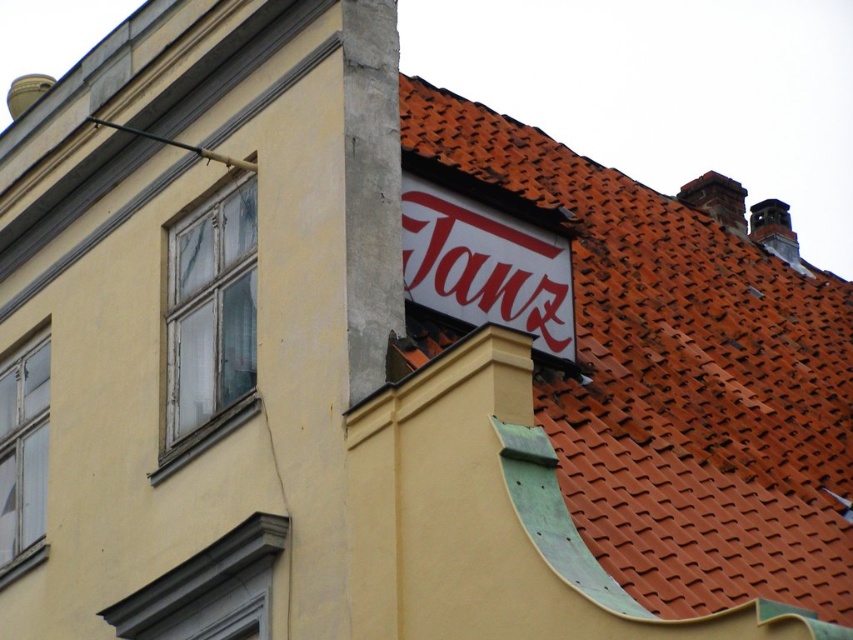
The height and width of the screenshot is (640, 853). What are the coordinates of `white wooden window at upper left` in the screenshot? It's located at (209, 320).

Is point (178, 282) closer to viewer compared to point (445, 301)?

No, it is behind (445, 301).

At what (x,y) coordinates should I click in order to perform the action: click on white wooden window at upper left. Please return your answer as a coordinate pair (x, y). Looking at the image, I should click on (209, 320).

Who is positioned more to the left, white matte sign at upper center or smooth gray window frame at lower left?

smooth gray window frame at lower left

Is white matte sign at upper center above smooth gray window frame at lower left?

Yes, white matte sign at upper center is above smooth gray window frame at lower left.

Where is `white matte sign at upper center`? The height and width of the screenshot is (640, 853). white matte sign at upper center is located at coordinates (486, 266).

Measure the distance between red clay tiles at upper right and smooth gray window frame at lower left.

red clay tiles at upper right and smooth gray window frame at lower left are 50.66 feet apart from each other.

Is point (753, 353) closer to camera compared to point (262, 592)?

That is False.

Between point (537, 401) and point (193, 576), which one is positioned in front?

Point (193, 576)

You are a GUI agent. You are given a task and a screenshot of the screen. Output one action in this format:
    pyautogui.click(x=<x>, y=<y>)
    Task: Click on the red clay tiles at upper right
    This screenshot has width=853, height=640.
    Given the screenshot: What is the action you would take?
    pyautogui.click(x=682, y=381)